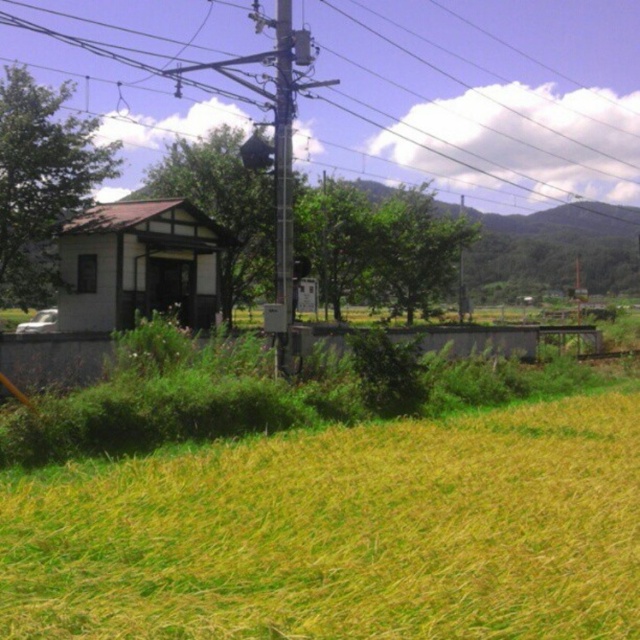
You are a farmer checking the height of crops in your field. You have a measuring stick that can reach up to 2 meters. You see the yellow grass at lower right and the metallic wire at upper center. Which object can your measuring stick reach?

The yellow grass at lower right has a lesser height compared to metallic wire at upper center. Since the measuring stick can reach up to 2 meters, it can reach the yellow grass at lower right but not the metallic wire at upper center if the wire is taller than 2 meters. However, without specific height measurements, we can only confirm that the yellow grass is shorter than the wire. If the wire is within the 2 meter limit, both could be measured. But based on the given information, the grass is definitely 2

You are a photographer trying to capture the metallic gray telegraph pole at center and the yellow grass at lower right in one frame. Based on their positions, which object appears closer to the camera?

The yellow grass at lower right appears closer to the camera because it is positioned below the metallic gray telegraph pole at center, indicating it is in the foreground.

You are a photographer wanting to capture the yellow grass at lower right and the metallic wire at upper center in the same frame. Based on their positions, can you determine which object is closer to the left edge of the photo?

The yellow grass at lower right is to the right of the metallic wire at upper center, so the metallic wire at upper center is closer to the left edge of the photo.